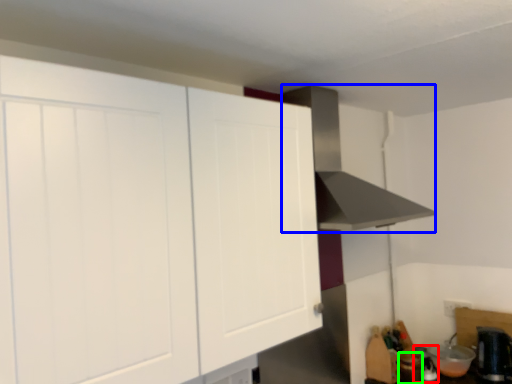
Question: Estimate the real-world distances between objects in this image. Which object is closer to appliance (highlighted by a red box), vent (highlighted by a blue box) or appliance (highlighted by a green box)?

Choices:
 (A) vent
 (B) appliance

Answer: (B)